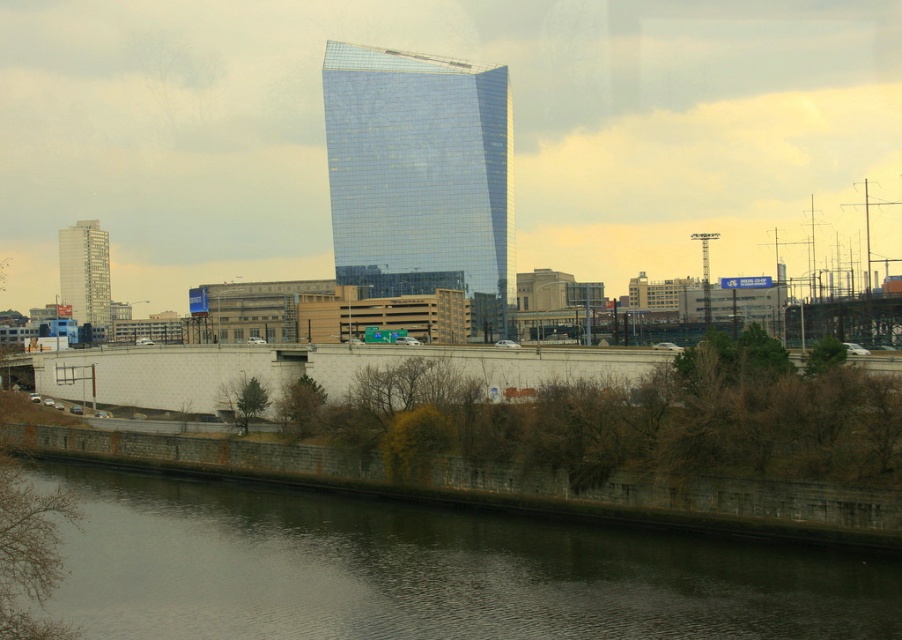
You are standing at the point labeled as point (428, 572) in the urban landscape scene. What surface are you currently standing on?

The point (428, 572) is on the dark gray concrete wall at lower center, so you are standing on the dark gray concrete wall at lower center.

You are a drone operator who needs to fly a drone from the matte gray building at left to the dark gray concrete wall at lower center. According to the scene description, what is the minimum distance you must fly the drone to reach the wall?

The dark gray concrete wall at lower center is 220.14 meters from the matte gray building at left, so the minimum distance you must fly the drone is 220.14 meters.